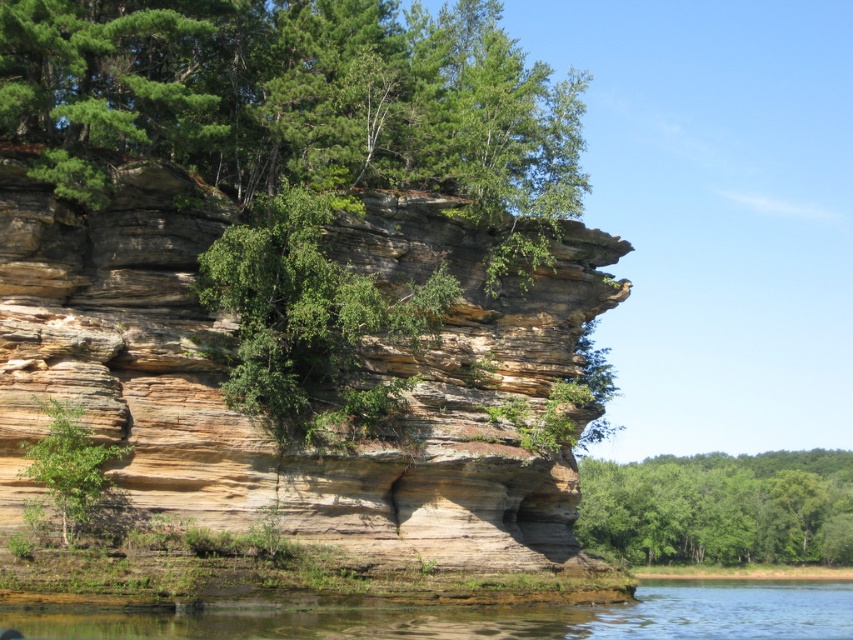
Between clear water at lower left and green leafy tree at lower right, which one appears on the left side from the viewer's perspective?

clear water at lower left

Can you confirm if clear water at lower left is thinner than green leafy tree at lower right?

In fact, clear water at lower left might be wider than green leafy tree at lower right.

This screenshot has width=853, height=640. Identify the location of clear water at lower left. (477, 616).

Locate an element on the screen. clear water at lower left is located at coordinates (477, 616).

What do you see at coordinates (257, 420) in the screenshot? This screenshot has height=640, width=853. I see `brown/rocky cliff at center` at bounding box center [257, 420].

Can you confirm if brown/rocky cliff at center is smaller than clear water at lower left?

Yes.

The width and height of the screenshot is (853, 640). I want to click on brown/rocky cliff at center, so click(x=257, y=420).

You are a GUI agent. You are given a task and a screenshot of the screen. Output one action in this format:
    pyautogui.click(x=<x>, y=<y>)
    Task: Click on the brown/rocky cliff at center
    This screenshot has width=853, height=640.
    Given the screenshot: What is the action you would take?
    pyautogui.click(x=257, y=420)

Is green leafy tree at lower right below green leafy tree at lower left?

Correct, green leafy tree at lower right is located below green leafy tree at lower left.

Which of these two, green leafy tree at lower right or green leafy tree at lower left, stands shorter?

green leafy tree at lower left

Who is more distant from viewer, (680, 532) or (86, 451)?

Positioned behind is point (680, 532).

You are a GUI agent. You are given a task and a screenshot of the screen. Output one action in this format:
    pyautogui.click(x=<x>, y=<y>)
    Task: Click on the green leafy tree at lower right
    
    Given the screenshot: What is the action you would take?
    pyautogui.click(x=718, y=508)